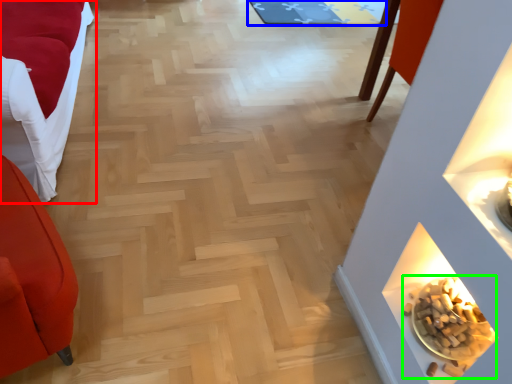
Question: Estimate the real-world distances between objects in this image. Which object is closer to furniture (highlighted by a red box), mat (highlighted by a blue box) or food (highlighted by a green box)?

Choices:
 (A) mat
 (B) food

Answer: (B)